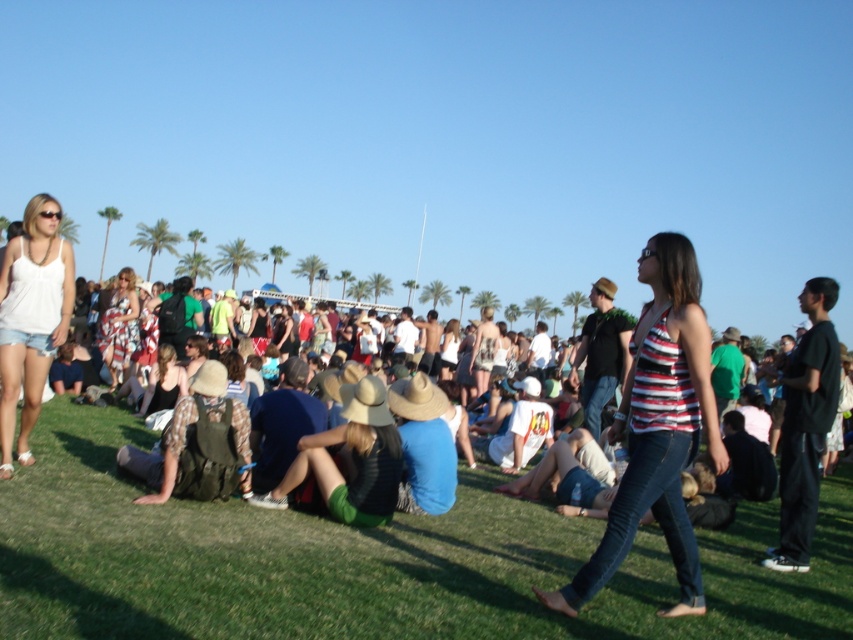
You are a photographer trying to capture a candid shot of the crowd at the music festival. You notice the green fabric hat at center and the matte black tank top at center. Which item would appear wider in your photo?

The green fabric hat at center would appear wider in the photo since its width is larger than that of the matte black tank top at center.

You are a photographer at the music festival and want to take a photo of both the green fabric hat at center and the printed cotton dress at center. Which object should you focus on first if you want to ensure both are in the frame without moving the camera?

You should focus on the printed cotton dress at center first because it is taller than the green fabric hat at center, so by centering the taller object, you can frame both effectively.